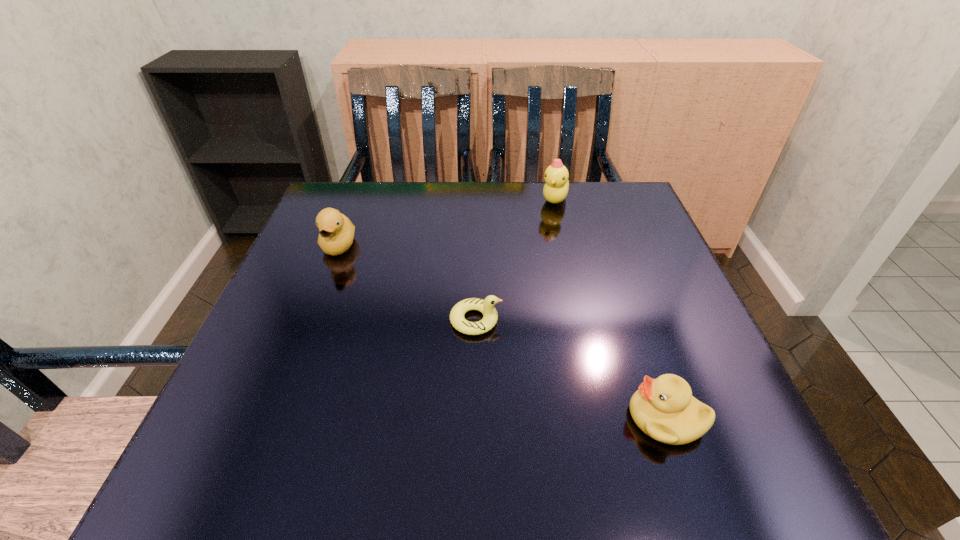
Identify the location of vacant space located on the front-facing side of the rightmost object. (590, 417).

Where is `free location located on the front-facing side of the rightmost object`? free location located on the front-facing side of the rightmost object is located at coordinates (558, 417).

At what (x,y) coordinates should I click in order to perform the action: click on vacant space positioned on the front-facing side of the rightmost object. Please return your answer as a coordinate pair (x, y). This screenshot has height=540, width=960. Looking at the image, I should click on (506, 417).

At what (x,y) coordinates should I click in order to perform the action: click on free point located on the face of the second nearest duckling. Please return your answer as a coordinate pair (x, y). Looking at the image, I should click on (528, 320).

Locate an element on the screen. object that is at the near edge is located at coordinates (663, 408).

You are a GUI agent. You are given a task and a screenshot of the screen. Output one action in this format:
    pyautogui.click(x=<x>, y=<y>)
    Task: Click on the object positioned at the left edge
    
    Given the screenshot: What is the action you would take?
    pyautogui.click(x=336, y=235)

I want to click on object at the right edge, so click(663, 408).

Where is `object that is positioned at the far left corner`? Image resolution: width=960 pixels, height=540 pixels. object that is positioned at the far left corner is located at coordinates (336, 235).

The width and height of the screenshot is (960, 540). Identify the location of object at the near right corner. (663, 408).

At what (x,y) coordinates should I click in order to perform the action: click on vacant point at the far edge. Please return your answer as a coordinate pair (x, y). Looking at the image, I should click on (425, 191).